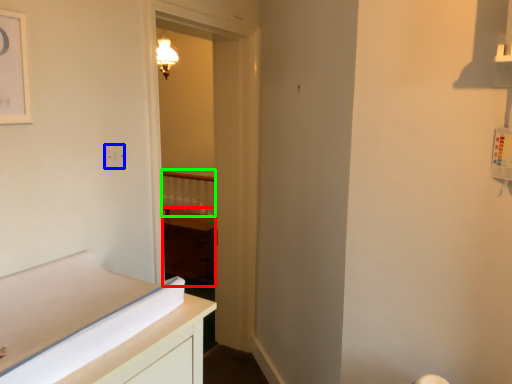
Question: Considering the real-world distances, which object is closest to cabinetry (highlighted by a red box)? electric outlet (highlighted by a blue box) or balustrade (highlighted by a green box).

Choices:
 (A) electric outlet
 (B) balustrade

Answer: (B)